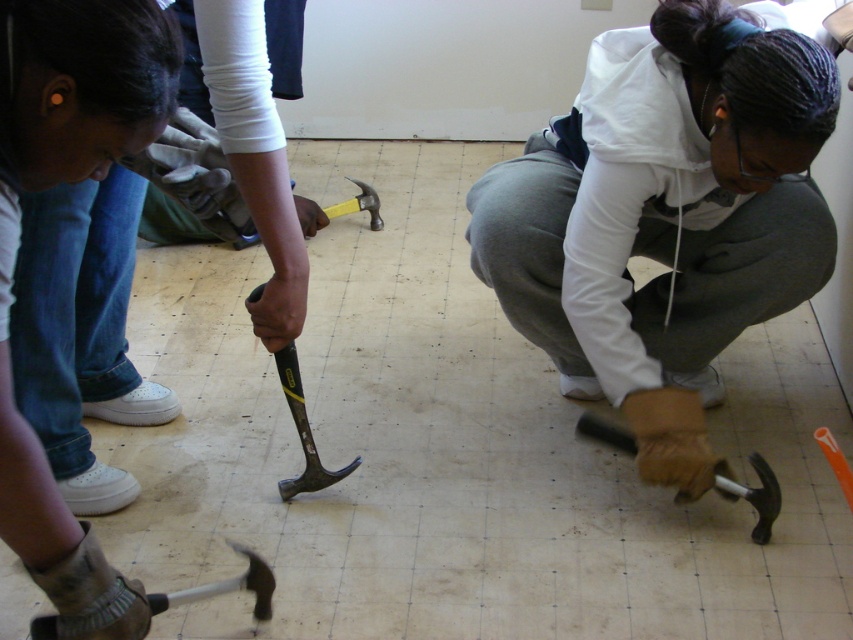
Locate an element on the screen. The width and height of the screenshot is (853, 640). matte black hammer at lower center is located at coordinates (664, 218).

Who is more distant from viewer, (753, 296) or (759, 492)?

The point (753, 296) is behind.

Locate an element on the screen. This screenshot has width=853, height=640. matte black hammer at lower center is located at coordinates pos(664,218).

Which of these two, matte black hammer at lower center or matte black hammer at center, stands taller?

Standing taller between the two is matte black hammer at lower center.

Between point (616, 330) and point (328, 220), which one is positioned behind?

The point (328, 220) is behind.

Which is behind, point (492, 244) or point (323, 224)?

Positioned behind is point (323, 224).

Identify the location of matte black hammer at lower center. (664, 218).

Does matte black hammer at lower right appear on the left side of silver metallic hammer at lower left?

Incorrect, matte black hammer at lower right is not on the left side of silver metallic hammer at lower left.

Is point (585, 426) positioned before point (55, 616)?

No, it is not.

Which is in front, point (766, 512) or point (38, 627)?

Point (38, 627) is more forward.

Image resolution: width=853 pixels, height=640 pixels. What are the coordinates of `matte black hammer at lower right` in the screenshot? It's located at (755, 496).